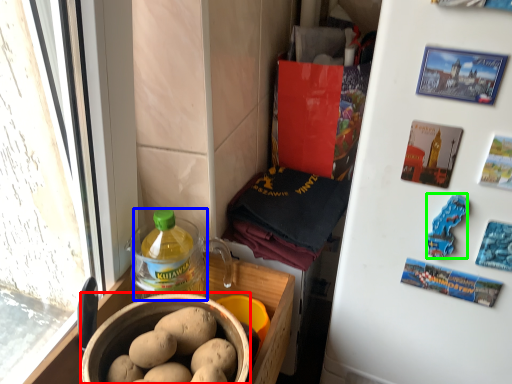
Question: Estimate the real-world distances between objects in this image. Which object is farther from bowl (highlighted by a red box), bottle (highlighted by a blue box) or food (highlighted by a green box)?

Choices:
 (A) bottle
 (B) food

Answer: (B)